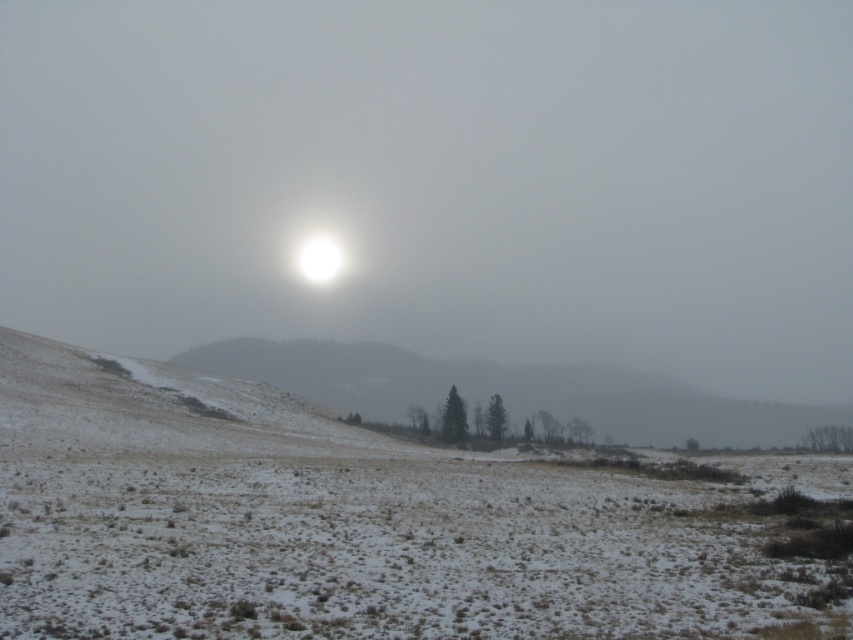
Consider the image. You are standing at the base of the winter landscape and want to walk towards the point that is closer to you. Which point should you head towards, point (538, 580) or point (225, 346)?

Point (538, 580) is in front of point (225, 346), so you should head towards point (538, 580) as it is closer to you.